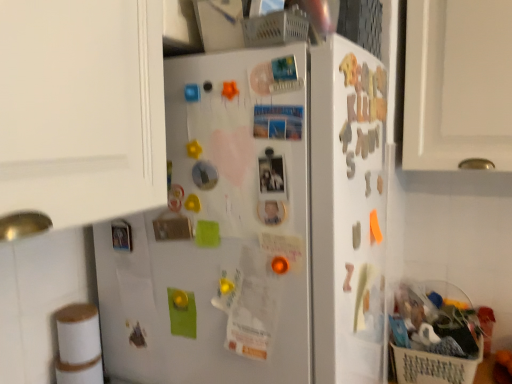
Question: From the image's perspective, is bamboo toilet paper at lower left on gold metallic magnet at upper right, the sixth magnet when ordered from right to left?

Choices:
 (A) no
 (B) yes

Answer: (A)

Question: Are bamboo toilet paper at lower left and gold metallic magnet at upper right, the sixth magnet when ordered from right to left, making contact?

Choices:
 (A) no
 (B) yes

Answer: (A)

Question: Considering the relative positions of bamboo toilet paper at lower left and gold metallic magnet at upper right, which ranks as the eighth magnet in left-to-right order, in the image provided, is bamboo toilet paper at lower left behind gold metallic magnet at upper right, which ranks as the eighth magnet in left-to-right order,?

Choices:
 (A) no
 (B) yes

Answer: (B)

Question: From a real-world perspective, is bamboo toilet paper at lower left on top of gold metallic magnet at upper right, which ranks as the eighth magnet in left-to-right order?

Choices:
 (A) yes
 (B) no

Answer: (B)

Question: Would you say gold metallic magnet at upper right, the sixth magnet when ordered from right to left, is part of bamboo toilet paper at lower left's contents?

Choices:
 (A) yes
 (B) no

Answer: (B)

Question: Does bamboo toilet paper at lower left have a greater height compared to gold metallic magnet at upper right, the sixth magnet when ordered from right to left?

Choices:
 (A) no
 (B) yes

Answer: (B)

Question: Considering the relative sizes of plastic shopping basket at lower right and metallic silver photo frame at left, which ranks as the thirteenth magnet in right-to-left order, in the image provided, is plastic shopping basket at lower right wider than metallic silver photo frame at left, which ranks as the thirteenth magnet in right-to-left order,?

Choices:
 (A) yes
 (B) no

Answer: (A)

Question: Is there a large distance between plastic shopping basket at lower right and metallic silver photo frame at left, which appears as the first magnet when viewed from the left?

Choices:
 (A) no
 (B) yes

Answer: (A)

Question: Is plastic shopping basket at lower right bigger than metallic silver photo frame at left, which ranks as the thirteenth magnet in right-to-left order?

Choices:
 (A) yes
 (B) no

Answer: (A)

Question: Are plastic shopping basket at lower right and metallic silver photo frame at left, which ranks as the thirteenth magnet in right-to-left order, beside each other?

Choices:
 (A) yes
 (B) no

Answer: (B)

Question: From the image's perspective, is plastic shopping basket at lower right on metallic silver photo frame at left, which appears as the first magnet when viewed from the left?

Choices:
 (A) no
 (B) yes

Answer: (A)

Question: Does plastic shopping basket at lower right appear on the left side of metallic silver photo frame at left, which ranks as the thirteenth magnet in right-to-left order?

Choices:
 (A) yes
 (B) no

Answer: (B)

Question: Does gold metallic magnet at upper right, the sixth magnet when ordered from right to left, have a greater height compared to yellow rubber at upper center, which is the tenth magnet from right to left?

Choices:
 (A) yes
 (B) no

Answer: (A)